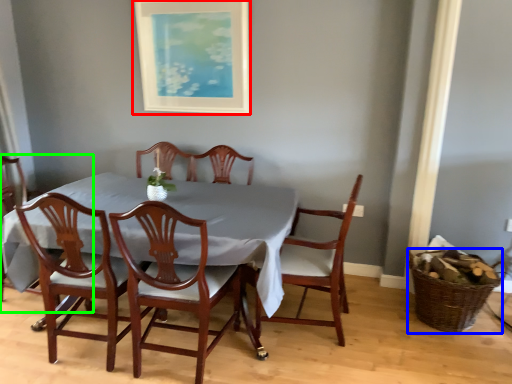
Question: Which is nearer to the picture frame (highlighted by a red box)? basket (highlighted by a blue box) or chair (highlighted by a green box).

Choices:
 (A) basket
 (B) chair

Answer: (B)